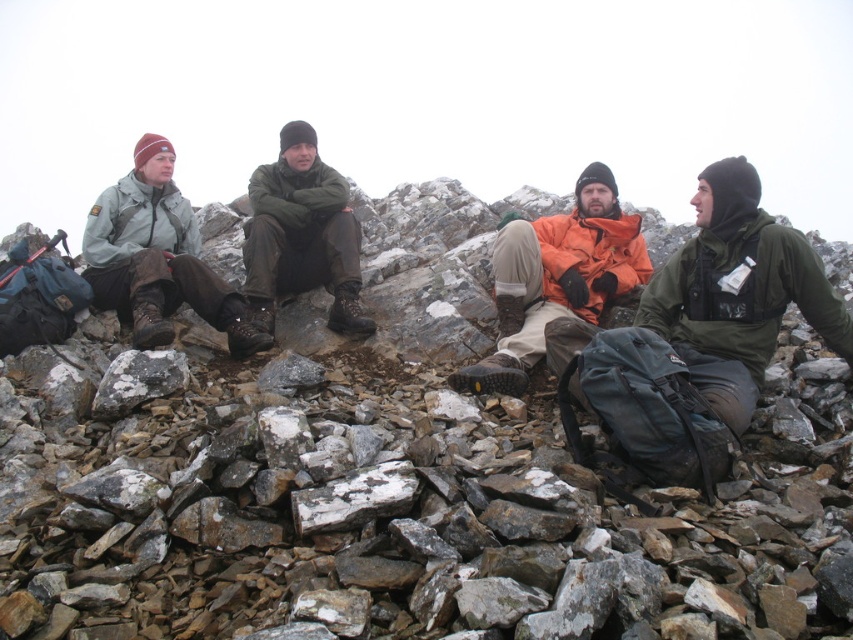
Question: Which object is farther from the camera taking this photo?

Choices:
 (A) gray/white speckled rock at center
 (B) orange fleece jacket at center
 (C) green matte jacket at upper right

Answer: (B)

Question: Is green matte jacket at upper right thinner than matte gray jacket at left?

Choices:
 (A) no
 (B) yes

Answer: (B)

Question: Which point is closer to the camera?

Choices:
 (A) (213, 332)
 (B) (115, 371)
 (C) (387, 481)

Answer: (C)

Question: Which point is farther from the camera taking this photo?

Choices:
 (A) (140, 211)
 (B) (653, 604)
 (C) (364, 480)

Answer: (A)

Question: Is green matte jacket at center behind white speckled rock at center?

Choices:
 (A) yes
 (B) no

Answer: (A)

Question: Does green matte jacket at center have a lesser width compared to gray/white speckled rock at center?

Choices:
 (A) yes
 (B) no

Answer: (B)